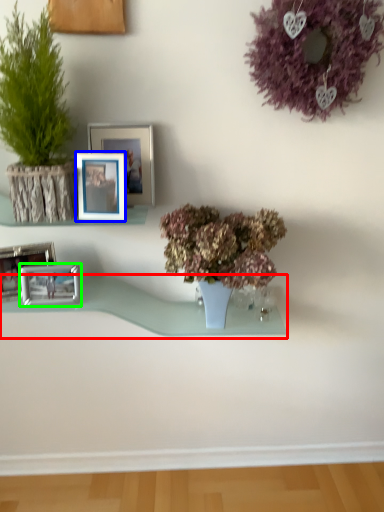
Question: Based on their relative distances, which object is nearer to window sill (highlighted by a red box)? Choose from picture frame (highlighted by a blue box) and picture frame (highlighted by a green box).

Choices:
 (A) picture frame
 (B) picture frame

Answer: (B)